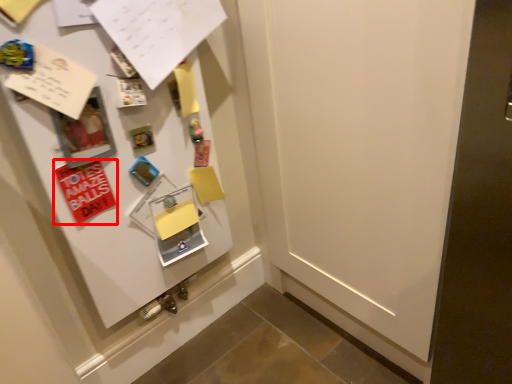
Question: From the image's perspective, what is the correct spatial relationship of postcard (annotated by the red box) in relation to paper?

Choices:
 (A) above
 (B) below

Answer: (B)